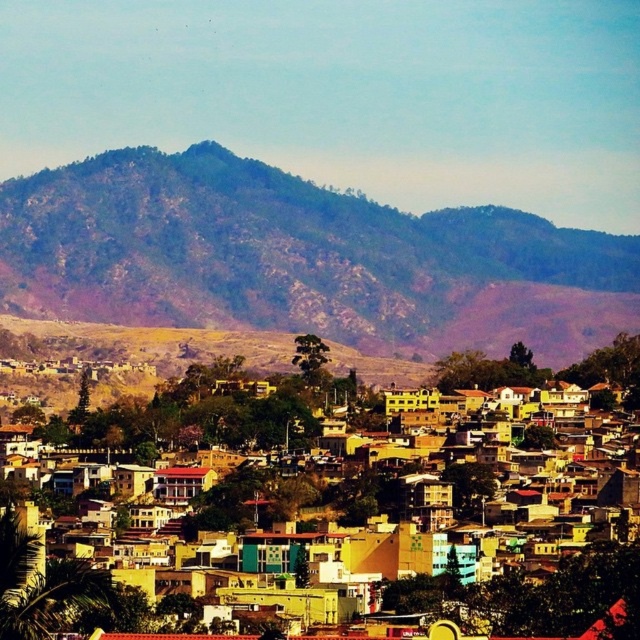
Is point (88, 307) positioned before point (536, 625)?

That is True.

Between brown rocky mountain at upper center and yellow matte buildings at center, which one has less height?

brown rocky mountain at upper center

What are the coordinates of `brown rocky mountain at upper center` in the screenshot? It's located at (301, 259).

This screenshot has width=640, height=640. I want to click on brown rocky mountain at upper center, so click(301, 259).